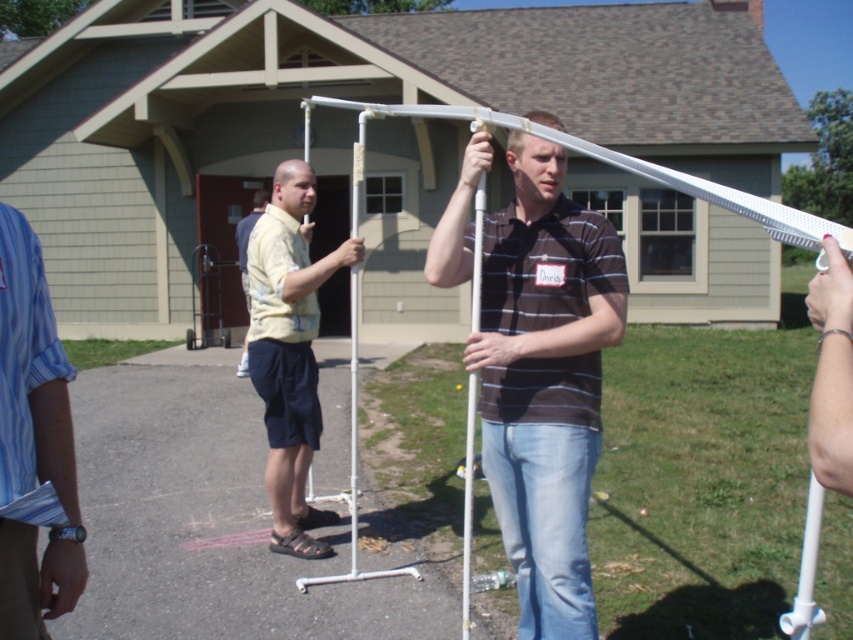
Question: Does skinny silver bracelet at upper right appear under white plastic pole at center?

Choices:
 (A) no
 (B) yes

Answer: (A)

Question: Considering the real-world distances, which object is farthest from the white plastic pole at center?

Choices:
 (A) matte white pole at center
 (B) yellow printed shirt at center
 (C) skinny silver bracelet at upper right
 (D) blue striped shirt at left

Answer: (C)

Question: Which object is positioned farthest from the white plastic pole at center?

Choices:
 (A) matte white pole at center
 (B) blue striped shirt at left

Answer: (B)

Question: Which point appears farthest from the camera in this image?

Choices:
 (A) (22, 369)
 (B) (262, 266)
 (C) (473, 227)
 (D) (254, 218)

Answer: (D)

Question: Can you confirm if yellow printed shirt at center is positioned to the right of yellow shirt at center?

Choices:
 (A) no
 (B) yes

Answer: (B)

Question: From the image, what is the correct spatial relationship of blue striped shirt at left in relation to yellow shirt at center?

Choices:
 (A) right
 (B) left

Answer: (A)